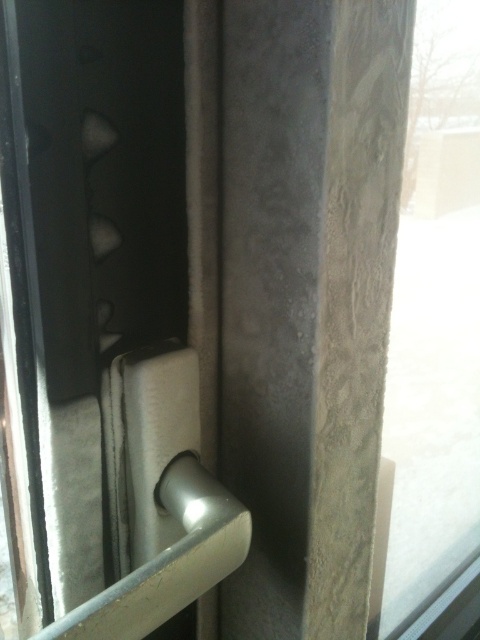
You are a passenger trying to exit the bus. You see a transparent glass window at right and a silver metallic door handle at center. Which object is bigger?

The transparent glass window at right has a larger size compared to the silver metallic door handle at center, so the transparent glass window at right is bigger.

From the picture: You are a passenger on a bus and want to see outside. You notice a transparent glass window at right and a silver metallic door handle at center. Which object allows you to look outside?

The transparent glass window at right allows you to look outside, as it is positioned over the silver metallic door handle at center and is meant for visibility.

Consider the image. You are a passenger on a bus and want to exit through the door. You see the silver metallic door handle at center and the transparent glass window at right. Which object is closer to you as you face the door?

The silver metallic door handle at center is closer to you because it is behind the transparent glass window at right, meaning the window is in front of the handle from your perspective.